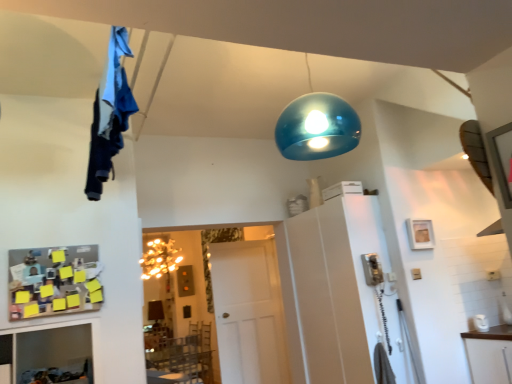
Question: From a real-world perspective, is wooden pegboard with sticky notes at lower left located higher than white glossy cabinet at right?

Choices:
 (A) yes
 (B) no

Answer: (A)

Question: Does wooden pegboard with sticky notes at lower left appear on the left side of white glossy cabinet at right?

Choices:
 (A) no
 (B) yes

Answer: (B)

Question: From a real-world perspective, is wooden pegboard with sticky notes at lower left under white glossy cabinet at right?

Choices:
 (A) no
 (B) yes

Answer: (A)

Question: Is wooden pegboard with sticky notes at lower left closer to camera compared to white glossy cabinet at right?

Choices:
 (A) no
 (B) yes

Answer: (B)

Question: Is wooden pegboard with sticky notes at lower left facing towards white glossy cabinet at right?

Choices:
 (A) yes
 (B) no

Answer: (B)

Question: From a real-world perspective, is white glossy cabinet at right above or below wooden picture frame at upper right?

Choices:
 (A) above
 (B) below

Answer: (B)

Question: Visually, is white glossy cabinet at right positioned to the left or to the right of wooden picture frame at upper right?

Choices:
 (A) right
 (B) left

Answer: (B)

Question: Is point (321, 362) positioned closer to the camera than point (417, 231)?

Choices:
 (A) farther
 (B) closer

Answer: (A)

Question: From the image's perspective, is white glossy cabinet at right located above or below wooden picture frame at upper right?

Choices:
 (A) below
 (B) above

Answer: (A)

Question: In the image, is white matte door at center positioned in front of or behind wooden picture frame at upper right?

Choices:
 (A) front
 (B) behind

Answer: (B)

Question: Considering the positions of white matte door at center and wooden picture frame at upper right in the image, is white matte door at center taller or shorter than wooden picture frame at upper right?

Choices:
 (A) short
 (B) tall

Answer: (B)

Question: Is white matte door at center situated inside wooden picture frame at upper right or outside?

Choices:
 (A) inside
 (B) outside

Answer: (B)

Question: Would you say white matte door at center is to the left or to the right of wooden picture frame at upper right in the picture?

Choices:
 (A) right
 (B) left

Answer: (B)

Question: Is wooden pegboard with sticky notes at lower left inside or outside of wooden picture frame at upper right?

Choices:
 (A) inside
 (B) outside

Answer: (B)

Question: From the image's perspective, is wooden pegboard with sticky notes at lower left located above or below wooden picture frame at upper right?

Choices:
 (A) above
 (B) below

Answer: (B)